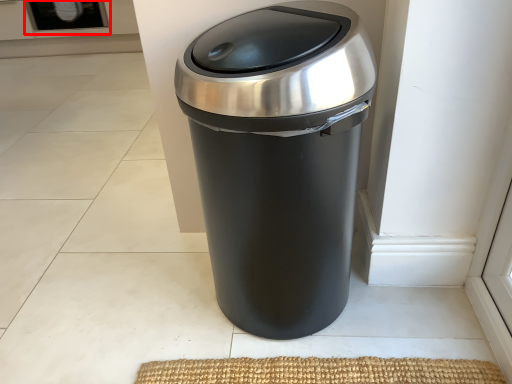
Question: Where is screen door (annotated by the red box) located in relation to waste container in the image?

Choices:
 (A) right
 (B) left

Answer: (B)